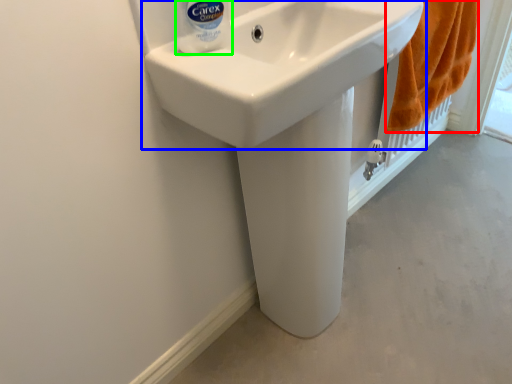
Question: Which object is positioned closest to bath towel (highlighted by a red box)? Select from sink (highlighted by a blue box) and cleaning product (highlighted by a green box).

Choices:
 (A) sink
 (B) cleaning product

Answer: (A)